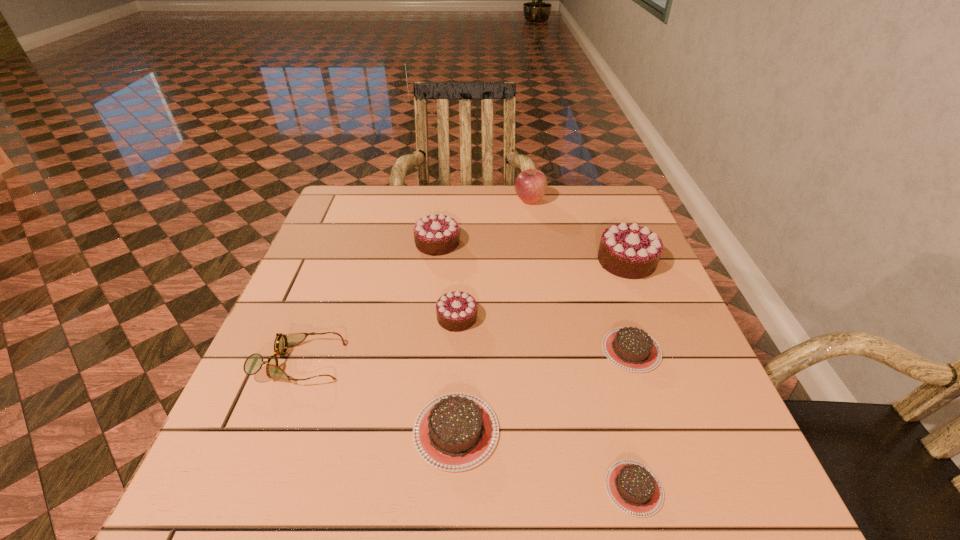
Identify the location of the tallest object. This screenshot has width=960, height=540. (530, 185).

This screenshot has width=960, height=540. What are the coordinates of `apple` in the screenshot? It's located at (x=530, y=185).

Image resolution: width=960 pixels, height=540 pixels. What are the coordinates of `the biggest chocolate chocolate cake` in the screenshot? It's located at (630, 251).

Identify the location of the seventh shortest object. click(630, 251).

Where is `the third tallest object`? This screenshot has width=960, height=540. the third tallest object is located at coordinates (437, 234).

The width and height of the screenshot is (960, 540). What are the coordinates of `the second biggest chocolate chocolate cake` in the screenshot? It's located at (437, 234).

This screenshot has width=960, height=540. Find the location of `the nearest chocolate chocolate cake`. the nearest chocolate chocolate cake is located at coordinates (456, 311).

Where is `the smallest chocolate chocolate cake`? The width and height of the screenshot is (960, 540). the smallest chocolate chocolate cake is located at coordinates (456, 311).

Identify the location of the leftmost object. (253, 363).

Locate an element on the screen. This screenshot has width=960, height=540. the fourth shortest object is located at coordinates (253, 363).